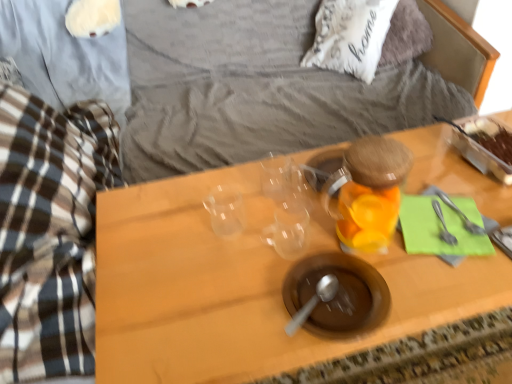
Question: Should I look upward or downward to see transparent glass jar at center-right?

Choices:
 (A) down
 (B) up

Answer: (B)

Question: Is silver metallic fork at right, which is the 1th silverware from right to left, beside transparent glass jar at center-right?

Choices:
 (A) yes
 (B) no

Answer: (B)

Question: From the image's perspective, is silver metallic fork at right, which is the 1th silverware from right to left, over transparent glass jar at center-right?

Choices:
 (A) yes
 (B) no

Answer: (B)

Question: Is silver metallic fork at right, which is the 1th silverware from right to left, smaller than transparent glass jar at center-right?

Choices:
 (A) yes
 (B) no

Answer: (A)

Question: Could you tell me if silver metallic fork at right, the second silverware positioned from the left, is facing transparent glass jar at center-right?

Choices:
 (A) yes
 (B) no

Answer: (B)

Question: Would you say transparent glass jar at center-right is part of silver metallic fork at right, which is the 1th silverware from right to left,'s contents?

Choices:
 (A) yes
 (B) no

Answer: (B)

Question: Is the depth of silver metallic fork at right, which is the 1th silverware from right to left, greater than that of transparent glass jar at center-right?

Choices:
 (A) no
 (B) yes

Answer: (B)

Question: Is white soft pillow at upper center completely or partially inside silver metallic fork at right, the second silverware positioned from the left?

Choices:
 (A) no
 (B) yes

Answer: (A)

Question: From a real-world perspective, is silver metallic fork at right, which is the 1th silverware from right to left, located higher than white soft pillow at upper center?

Choices:
 (A) no
 (B) yes

Answer: (B)

Question: Could you tell me if silver metallic fork at right, which is the 1th silverware from right to left, is turned towards white soft pillow at upper center?

Choices:
 (A) no
 (B) yes

Answer: (A)

Question: Is silver metallic fork at right, which is the 1th silverware from right to left, completely or partially outside of white soft pillow at upper center?

Choices:
 (A) yes
 (B) no

Answer: (A)

Question: From the image's perspective, would you say silver metallic fork at right, which is the 1th silverware from right to left, is shown under white soft pillow at upper center?

Choices:
 (A) yes
 (B) no

Answer: (A)

Question: Is silver metallic fork at right, which is the 1th silverware from right to left, behind white soft pillow at upper center?

Choices:
 (A) no
 (B) yes

Answer: (A)

Question: Is silver metallic fork at right, which ranks as the 1th silverware in left-to-right order, turned away from white soft pillow at upper center?

Choices:
 (A) yes
 (B) no

Answer: (A)